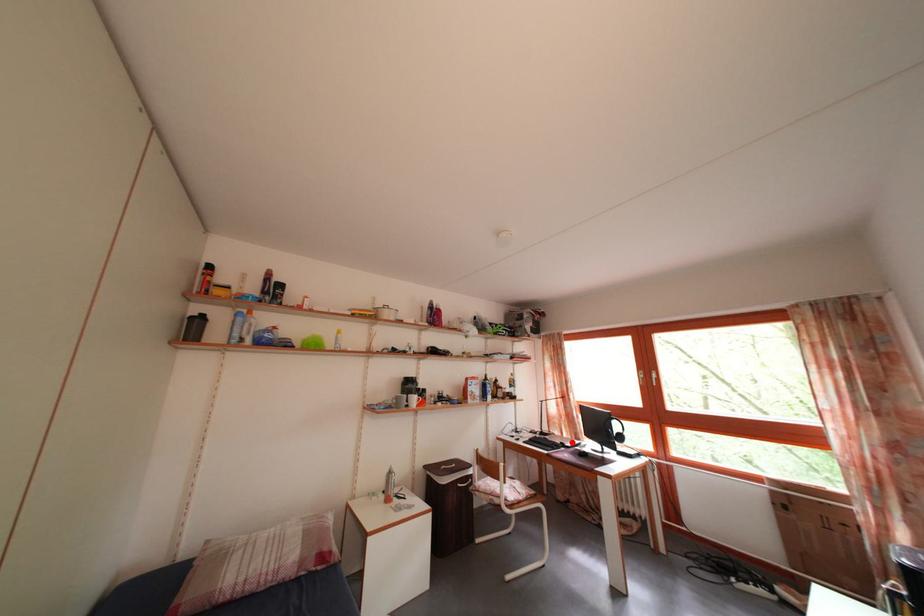
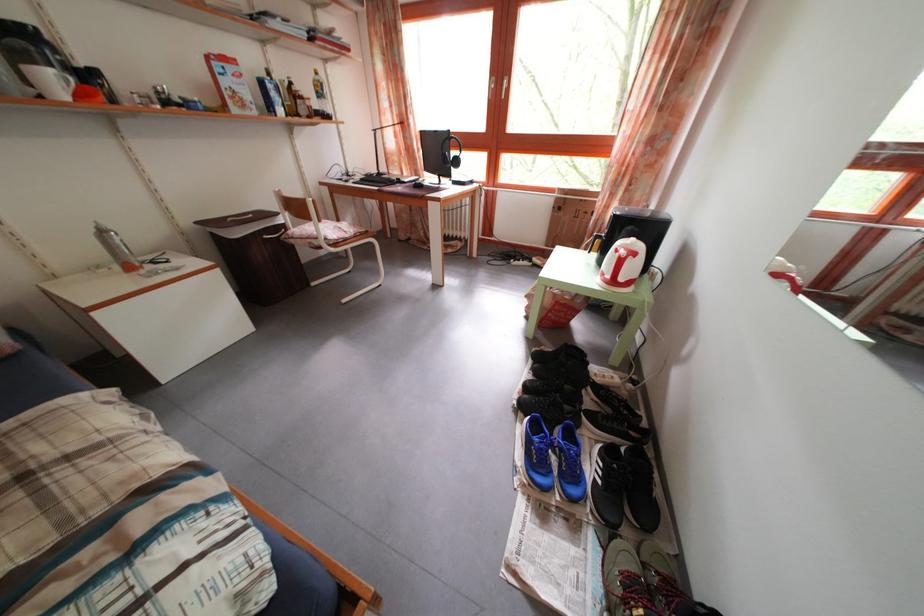
The point at the highlighted location is marked in the first image. Where is the corresponding point in the second image?

(412, 182)